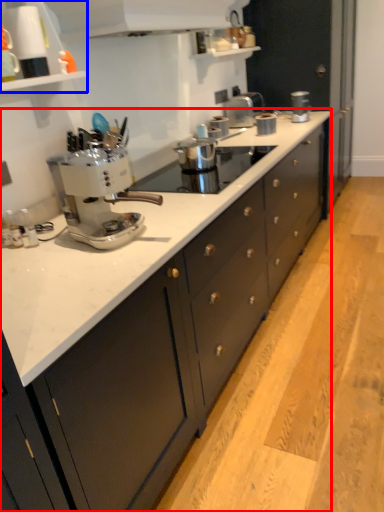
Question: Among these objects, which one is nearest to the camera, cabinetry (highlighted by a red box) or shelf (highlighted by a blue box)?

Choices:
 (A) cabinetry
 (B) shelf

Answer: (A)